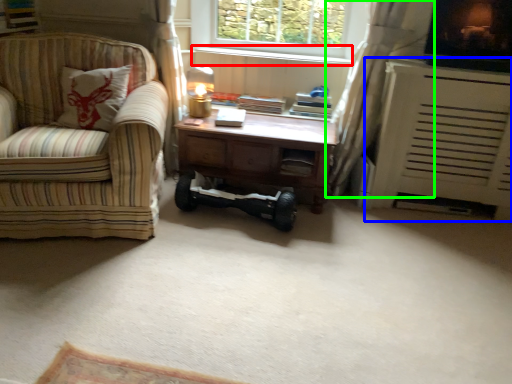
Question: Which object is positioned closest to window sill (highlighted by a red box)? Select from heater (highlighted by a blue box) and curtain (highlighted by a green box).

Choices:
 (A) heater
 (B) curtain

Answer: (B)